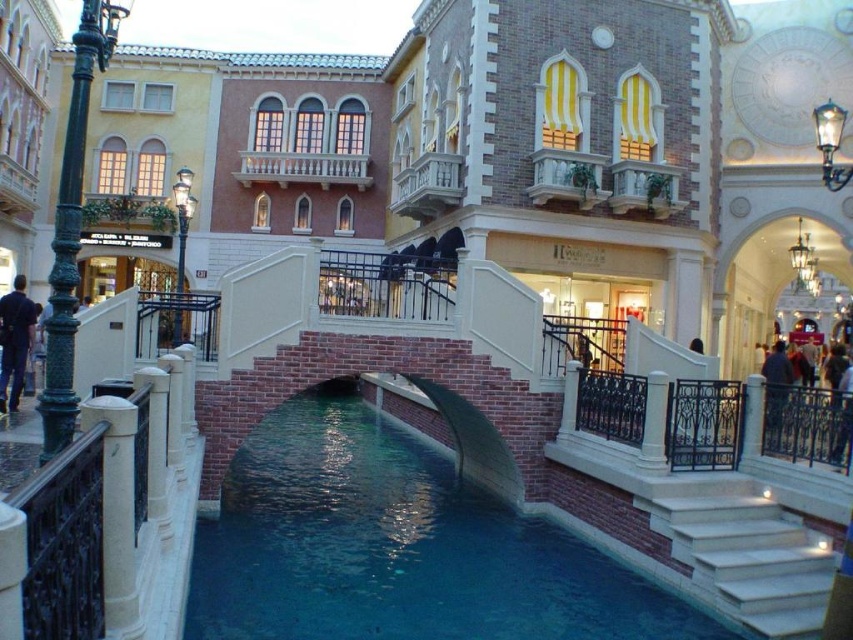
You are a tour guide leading a group of visitors. You want to point out the blue smooth water at center and the white marble stairs at lower right. How far apart are these two landmarks?

The distance between the blue smooth water at center and the white marble stairs at lower right is 5.98 meters.

You are standing at the curved bridge and want to reach the point marked by point (680, 557). Is this point closer to you than point (7, 300)?

Yes, point (680, 557) is in front of point (7, 300), so it is closer to you.